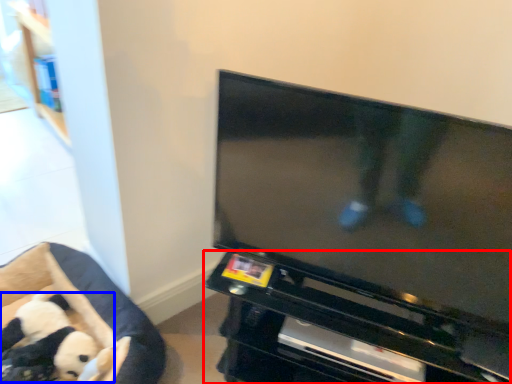
Question: Which of the following is the closest to the observer, entertainment center (highlighted by a red box) or toy (highlighted by a blue box)?

Choices:
 (A) entertainment center
 (B) toy

Answer: (A)